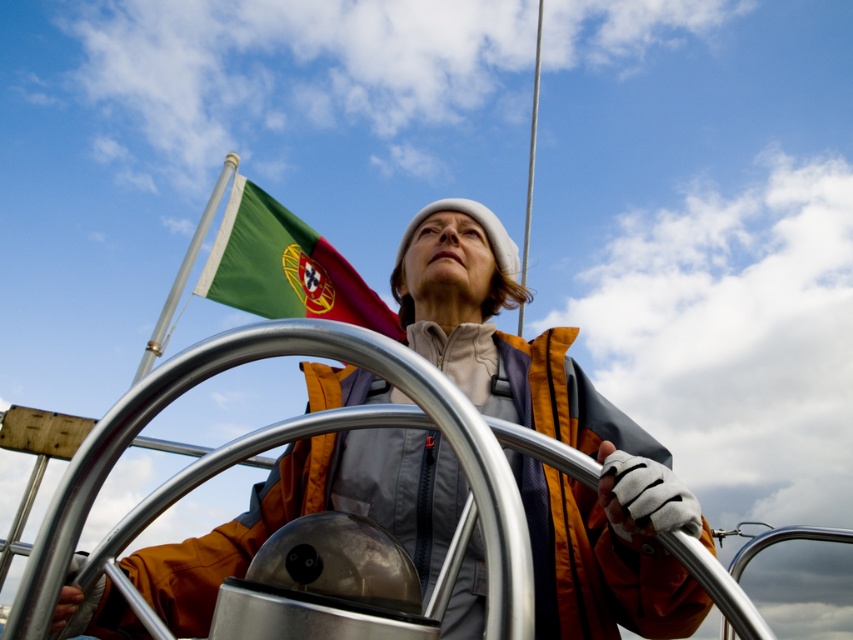
Question: Is orange fabric jacket at center below green fabric flag at upper left?

Choices:
 (A) yes
 (B) no

Answer: (A)

Question: Where is orange fabric jacket at center located in relation to green fabric flag at upper left in the image?

Choices:
 (A) left
 (B) right

Answer: (B)

Question: Which of the following is the closest to the observer?

Choices:
 (A) (351, 458)
 (B) (363, 289)

Answer: (A)

Question: Which of the following is the closest to the observer?

Choices:
 (A) orange fabric jacket at center
 (B) green fabric flag at upper left

Answer: (A)

Question: Observing the image, what is the correct spatial positioning of orange fabric jacket at center in reference to green fabric flag at upper left?

Choices:
 (A) right
 (B) left

Answer: (A)